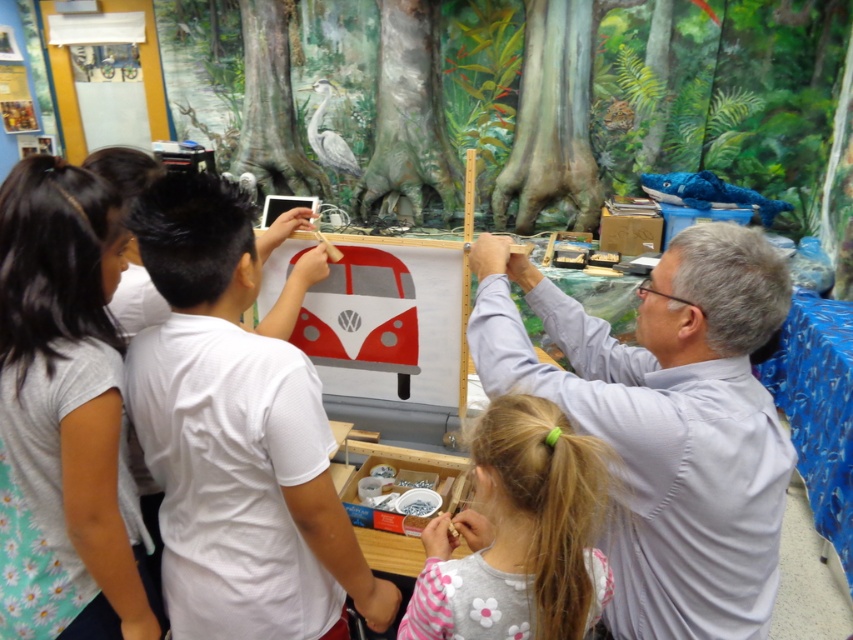
You are standing in the room where the model VW bus is being worked on. You need to reach a tool located at point (723, 515). If your arm can reach 1 meter, can you reach it without moving?

The distance of point (723, 515) from the camera is 1.02 meters, so your arm cannot reach it since it is slightly farther than 1 meter.